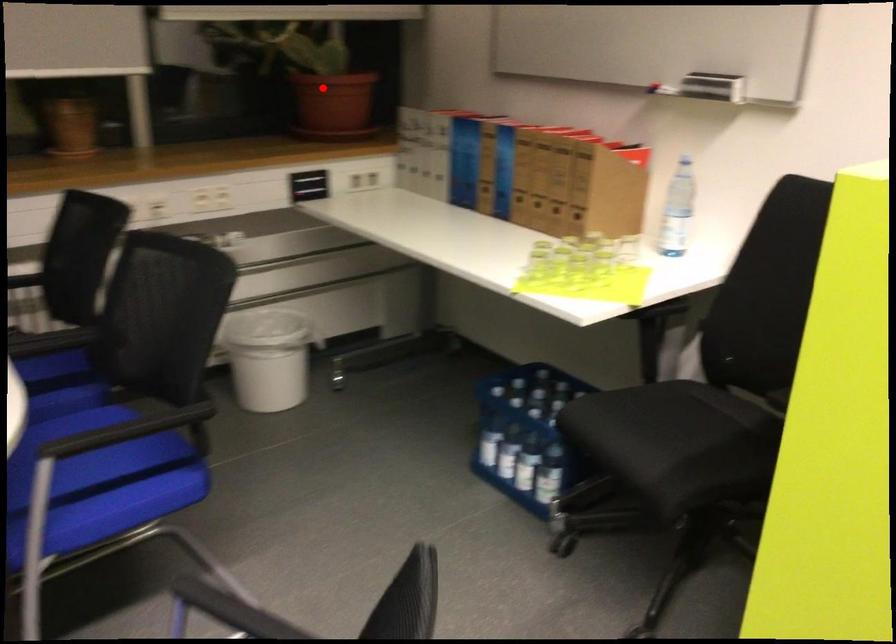
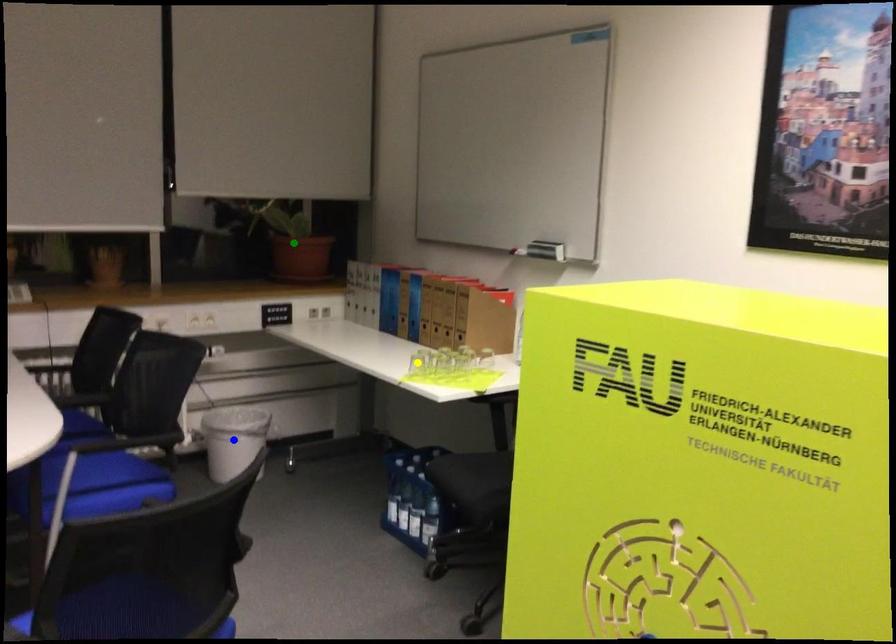
Question: I am providing you with two images of the same scene from different viewpoints. A red point is marked on the first image. You are given multiple points on the second image. Which mark in image 2 goes with the point in image 1?

Choices:
 (A) blue point
 (B) green point
 (C) yellow point

Answer: (B)